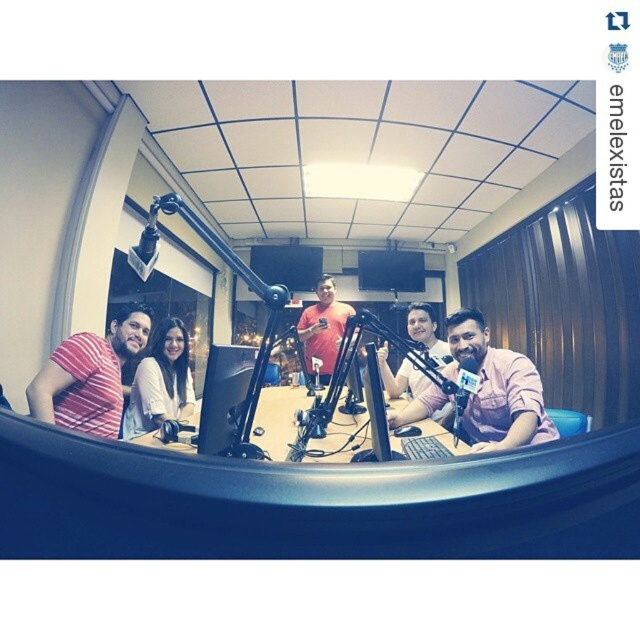
Is matte black microphone at center bigger than striped cotton shirt at left?

Correct, matte black microphone at center is larger in size than striped cotton shirt at left.

Can you confirm if matte black microphone at center is thinner than striped cotton shirt at left?

Yes.

Does point (29, 340) lie behind point (90, 413)?

Yes, it is.

The width and height of the screenshot is (640, 640). Identify the location of matte black microphone at center. (314, 502).

Who is taller, striped cotton shirt at left or matte black monitor at center?

striped cotton shirt at left

Who is more forward, (141,346) or (218,436)?

Point (218,436) is more forward.

Who is more forward, (109, 337) or (252, 368)?

Point (252, 368) is in front.

The width and height of the screenshot is (640, 640). In order to click on striped cotton shirt at left in this screenshot , I will do `click(88, 376)`.

Which is behind, point (77, 404) or point (332, 292)?

The point (332, 292) is behind.

Does striped cotton shirt at left have a larger size compared to matte red shirt at center?

No, striped cotton shirt at left is not bigger than matte red shirt at center.

Which is in front, point (68, 381) or point (308, 362)?

Point (68, 381) is more forward.

Image resolution: width=640 pixels, height=640 pixels. Identify the location of striped cotton shirt at left. (88, 376).